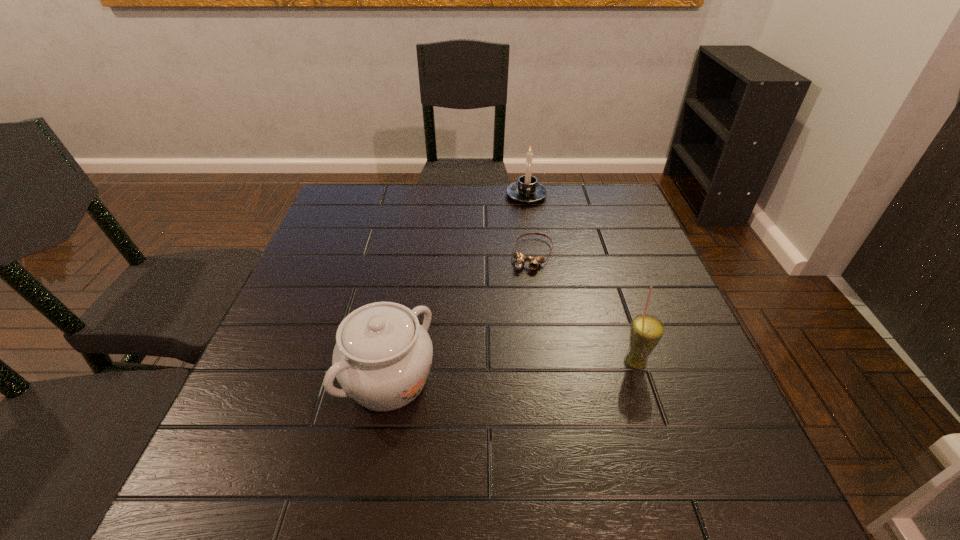
Identify the location of free space at the far left corner. Image resolution: width=960 pixels, height=540 pixels. (381, 205).

At what (x,y) coordinates should I click in order to perform the action: click on free space at the far right corner of the desktop. Please return your answer as a coordinate pair (x, y). This screenshot has width=960, height=540. Looking at the image, I should click on [x=592, y=193].

Locate an element on the screen. The width and height of the screenshot is (960, 540). free space between the farthest object and the straw for drinking is located at coordinates (581, 279).

At what (x,y) coordinates should I click in order to perform the action: click on empty space that is in between the leftmost object and the farthest object. Please return your answer as a coordinate pair (x, y). Image resolution: width=960 pixels, height=540 pixels. Looking at the image, I should click on (458, 288).

This screenshot has height=540, width=960. Find the location of `free space between the farthest object and the rightmost object`. free space between the farthest object and the rightmost object is located at coordinates (581, 279).

Where is `vacant area that lies between the candle holder and the straw for drinking`? The height and width of the screenshot is (540, 960). vacant area that lies between the candle holder and the straw for drinking is located at coordinates (581, 279).

Where is `vacant area that lies between the candle holder and the chinaware`? vacant area that lies between the candle holder and the chinaware is located at coordinates (458, 288).

Identify the location of vacant area that lies between the farthest object and the chinaware. (458, 288).

Identify the location of vacant area that lies between the second farthest object and the farthest object. (530, 225).

The width and height of the screenshot is (960, 540). Identify the location of free spot between the candle holder and the third nearest object. (530, 225).